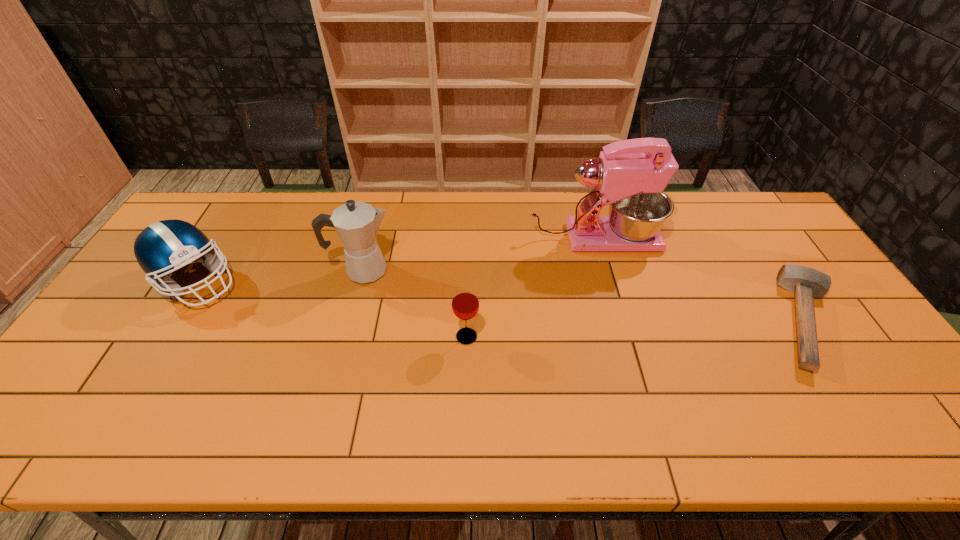
Identify the location of vacant area located at the front of the football helmet with the faceguard. The width and height of the screenshot is (960, 540). (316, 282).

The width and height of the screenshot is (960, 540). I want to click on free spot located on the left of the third object from left to right, so click(358, 336).

Where is `vacant space located on the left of the shortest object`? vacant space located on the left of the shortest object is located at coordinates (674, 321).

The width and height of the screenshot is (960, 540). Identify the location of object that is at the far edge. (630, 175).

Where is `object that is at the left edge`? This screenshot has height=540, width=960. object that is at the left edge is located at coordinates (163, 247).

Find the location of `object at the right edge`. object at the right edge is located at coordinates (806, 283).

In order to click on vacant space at the far edge of the desktop in this screenshot , I will do `click(685, 235)`.

Where is `free space at the near edge of the desktop`? free space at the near edge of the desktop is located at coordinates (180, 444).

I want to click on vacant point at the left edge, so click(x=130, y=369).

Where is `vacant region at the far right corner`? This screenshot has width=960, height=540. vacant region at the far right corner is located at coordinates (770, 231).